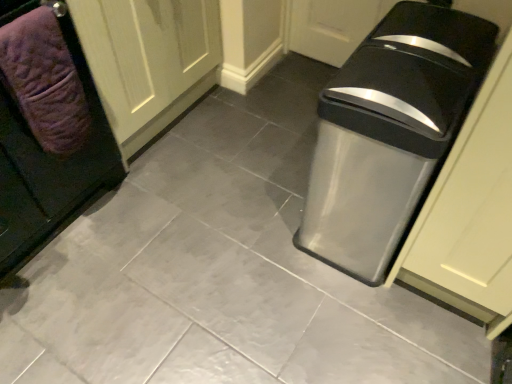
Question: Should I look upward or downward to see purple textured towel at left?

Choices:
 (A) up
 (B) down

Answer: (A)

Question: Are purple textured towel at left and white wood door at upper left making contact?

Choices:
 (A) yes
 (B) no

Answer: (B)

Question: Does purple textured towel at left have a greater height compared to white wood door at upper left?

Choices:
 (A) yes
 (B) no

Answer: (B)

Question: Does purple textured towel at left have a lesser width compared to white wood door at upper left?

Choices:
 (A) no
 (B) yes

Answer: (B)

Question: Could you tell me if purple textured towel at left is facing white wood door at upper left?

Choices:
 (A) no
 (B) yes

Answer: (A)

Question: Does purple textured towel at left appear on the right side of white wood door at upper left?

Choices:
 (A) yes
 (B) no

Answer: (A)

Question: Is white wood door at upper left surrounded by purple textured towel at left?

Choices:
 (A) no
 (B) yes

Answer: (A)

Question: Is purple quilted towel at left not near metallic gray trash can at right?

Choices:
 (A) no
 (B) yes

Answer: (A)

Question: Is purple quilted towel at left facing away from metallic gray trash can at right?

Choices:
 (A) no
 (B) yes

Answer: (A)

Question: From the image's perspective, does purple quilted towel at left appear lower than metallic gray trash can at right?

Choices:
 (A) no
 (B) yes

Answer: (A)

Question: Can you confirm if purple quilted towel at left is positioned to the left of metallic gray trash can at right?

Choices:
 (A) no
 (B) yes

Answer: (B)

Question: Can you confirm if purple quilted towel at left is taller than metallic gray trash can at right?

Choices:
 (A) no
 (B) yes

Answer: (B)

Question: From a real-world perspective, is purple quilted towel at left on top of metallic gray trash can at right?

Choices:
 (A) no
 (B) yes

Answer: (B)

Question: Does metallic gray trash can at right come behind white wood door at upper left?

Choices:
 (A) yes
 (B) no

Answer: (B)